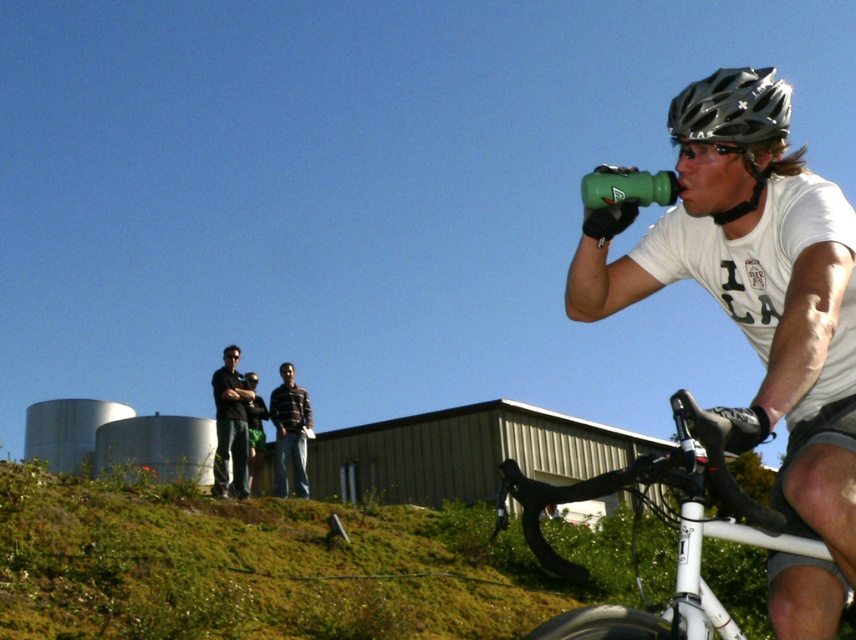
Does green matte water bottle at right have a greater height compared to black matte helmet at upper right?

Indeed, green matte water bottle at right has a greater height compared to black matte helmet at upper right.

Between green matte water bottle at right and black matte helmet at upper right, which one has less height?

black matte helmet at upper right is shorter.

What do you see at coordinates (758, 308) in the screenshot?
I see `green matte water bottle at right` at bounding box center [758, 308].

You are a GUI agent. You are given a task and a screenshot of the screen. Output one action in this format:
    pyautogui.click(x=<x>, y=<y>)
    Task: Click on the green matte water bottle at right
    
    Given the screenshot: What is the action you would take?
    pyautogui.click(x=758, y=308)

Is white matte bicycle at lower right above black matte helmet at upper right?

No, white matte bicycle at lower right is not above black matte helmet at upper right.

Who is shorter, white matte bicycle at lower right or black matte helmet at upper right?

white matte bicycle at lower right is shorter.

The height and width of the screenshot is (640, 856). In order to click on white matte bicycle at lower right in this screenshot , I will do `click(663, 520)`.

Which is more to the right, green matte water bottle at right or striped cotton shirt at center?

Positioned to the right is green matte water bottle at right.

Does green matte water bottle at right have a greater height compared to striped cotton shirt at center?

No, green matte water bottle at right is not taller than striped cotton shirt at center.

The height and width of the screenshot is (640, 856). I want to click on green matte water bottle at right, so click(758, 308).